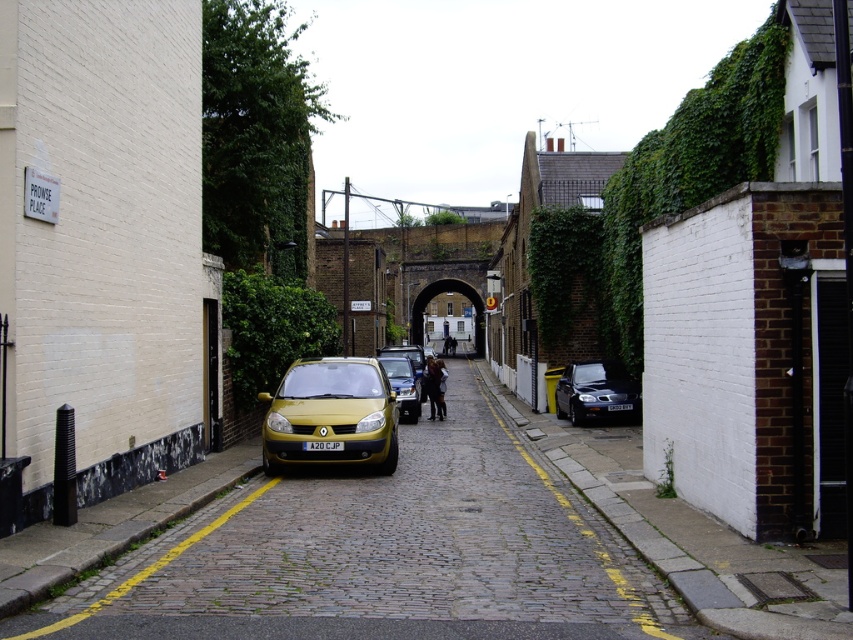
Between shiny black car at center and metallic gold car at center, which one has less height?

shiny black car at center

How much distance is there between shiny black car at center and metallic gold car at center?

The distance of shiny black car at center from metallic gold car at center is 4.82 meters.

Who is more forward, (602, 390) or (386, 362)?

Point (602, 390) is more forward.

The height and width of the screenshot is (640, 853). I want to click on shiny black car at center, so click(595, 390).

Does dark brown leather jacket at center have a lesser height compared to white plastic license plate at center?

No, dark brown leather jacket at center is not shorter than white plastic license plate at center.

Does dark brown leather jacket at center appear on the right side of white plastic license plate at center?

Correct, you'll find dark brown leather jacket at center to the right of white plastic license plate at center.

This screenshot has width=853, height=640. Describe the element at coordinates (434, 388) in the screenshot. I see `dark brown leather jacket at center` at that location.

This screenshot has height=640, width=853. I want to click on dark brown leather jacket at center, so click(434, 388).

Does dark brown leather jacket at center appear on the left side of black plastic license plate at center?

Correct, you'll find dark brown leather jacket at center to the left of black plastic license plate at center.

Does point (430, 392) lie in front of point (608, 404)?

That is False.

I want to click on dark brown leather jacket at center, so click(x=434, y=388).